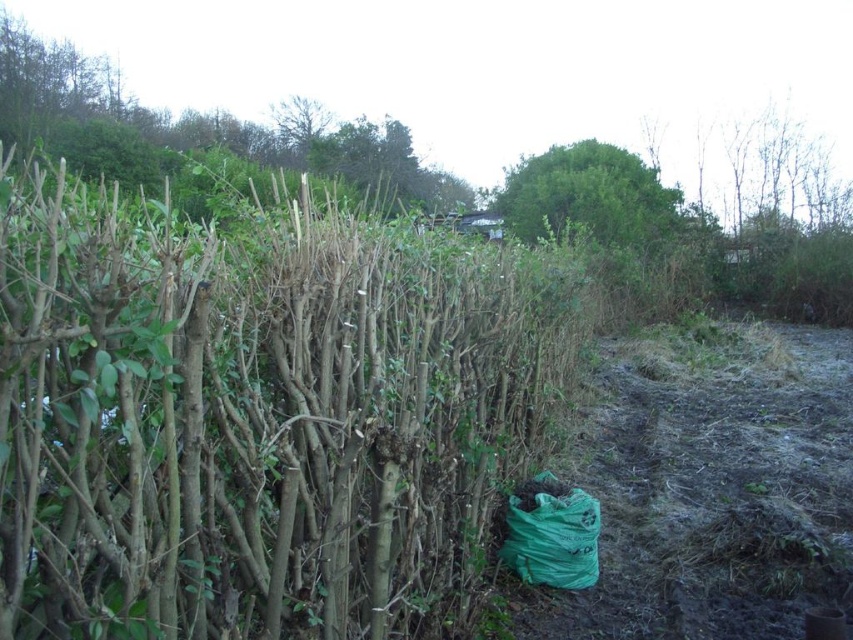
Does green fabric bag at lower center appear on the right side of green leafy tree at upper left?

Yes, green fabric bag at lower center is to the right of green leafy tree at upper left.

Measure the distance between point (x=294, y=360) and camera.

Point (x=294, y=360) and camera are 8.20 feet apart from each other.

Between point (250, 552) and point (199, 134), which one is positioned in front?

Positioned in front is point (250, 552).

The width and height of the screenshot is (853, 640). Identify the location of green fabric bag at lower center. (258, 413).